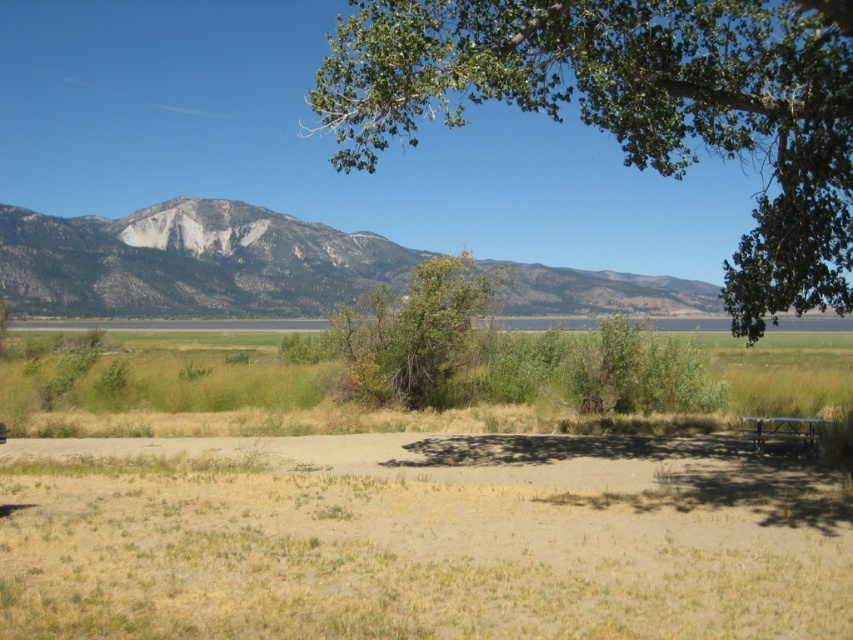
Can you confirm if green leafy tree at center is thinner than metallic silver picnic table at lower right?

In fact, green leafy tree at center might be wider than metallic silver picnic table at lower right.

Who is more forward, (438,326) or (761,426)?

Point (761,426) is more forward.

Which is behind, point (415, 356) or point (811, 440)?

The point (415, 356) is more distant.

Image resolution: width=853 pixels, height=640 pixels. In order to click on green leafy tree at center in this screenshot , I will do `click(409, 333)`.

What do you see at coordinates (635, 106) in the screenshot?
I see `green leafy tree at upper center` at bounding box center [635, 106].

Who is higher up, green leafy tree at upper center or rocky gray mountain at center?

green leafy tree at upper center

Describe the element at coordinates (635, 106) in the screenshot. I see `green leafy tree at upper center` at that location.

You are a GUI agent. You are given a task and a screenshot of the screen. Output one action in this format:
    pyautogui.click(x=<x>, y=<y>)
    Task: Click on the green leafy tree at upper center
    
    Given the screenshot: What is the action you would take?
    pyautogui.click(x=635, y=106)

Does brown sandy dirt at lower center appear on the left side of green leafy tree at upper center?

Yes, brown sandy dirt at lower center is to the left of green leafy tree at upper center.

Who is more forward, (45,506) or (396,113)?

Point (45,506) is in front.

I want to click on brown sandy dirt at lower center, so click(x=421, y=538).